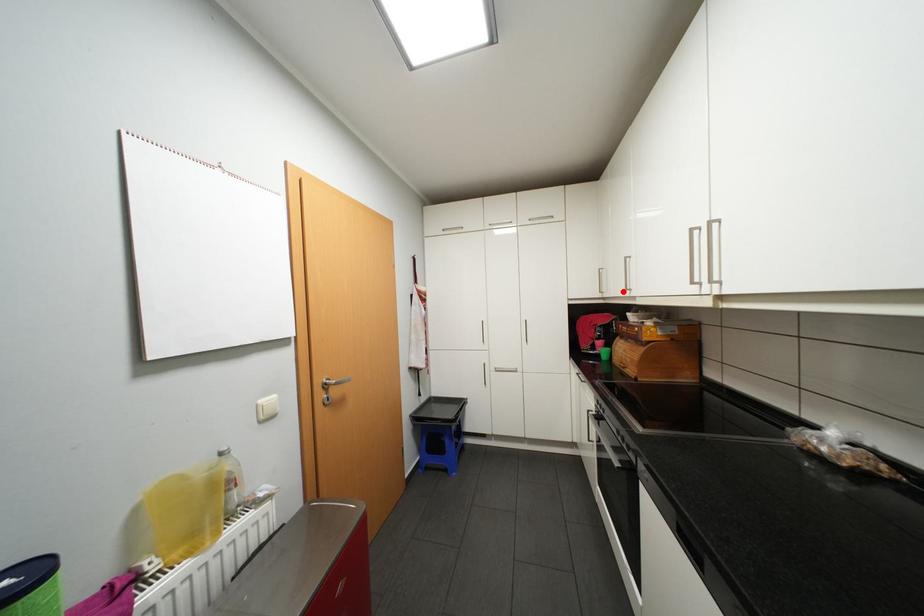
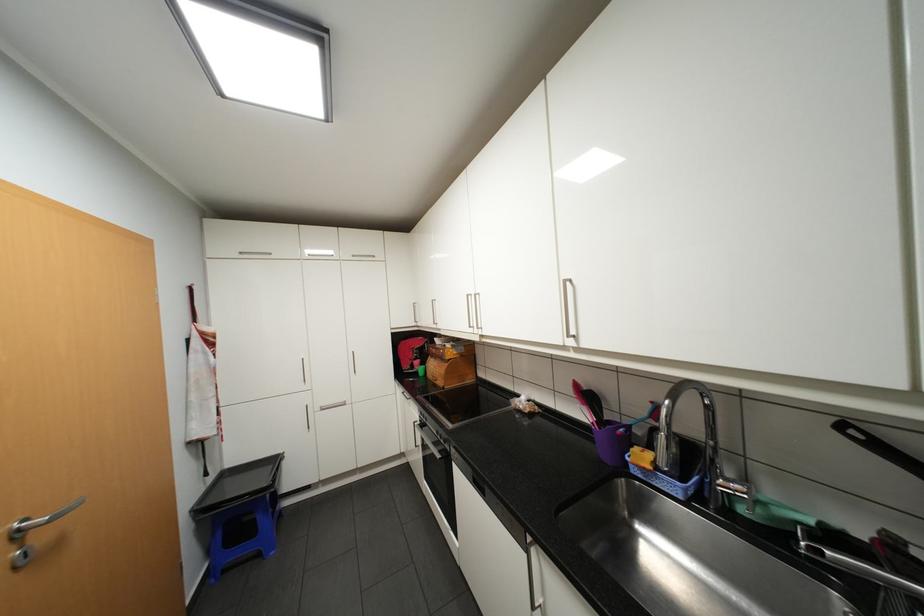
Find the pixel in the second image that matches the highlighted location in the first image.

(434, 323)